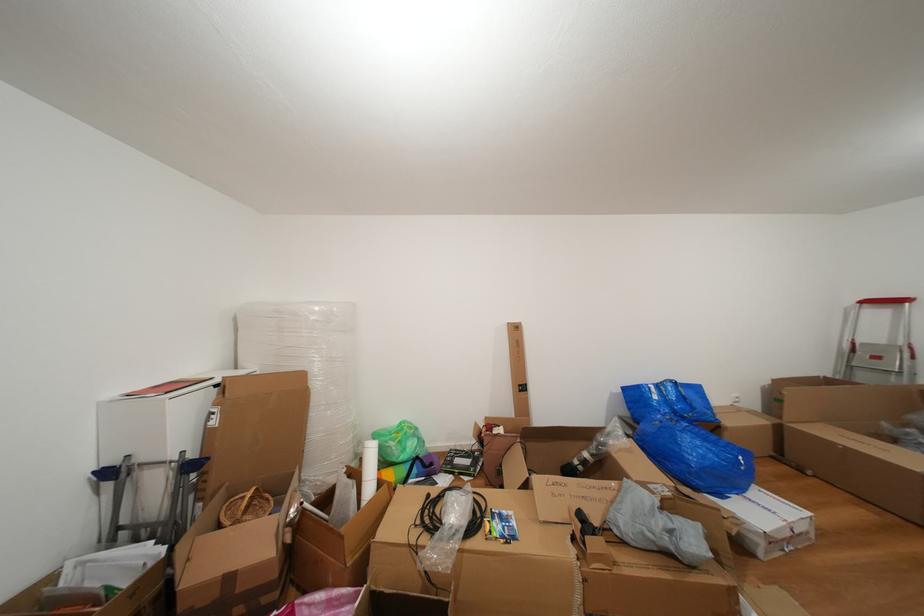
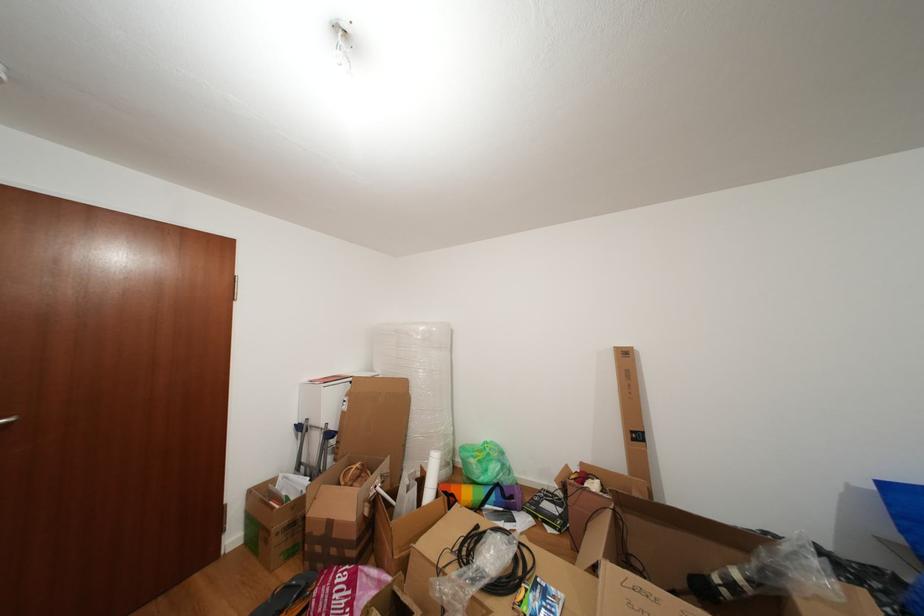
Question: Based on the continuous images, in which direction is the camera rotating? Reply with the corresponding letter.

Choices:
 (A) Left
 (B) Right
 (C) Up
 (D) Down

Answer: (A)